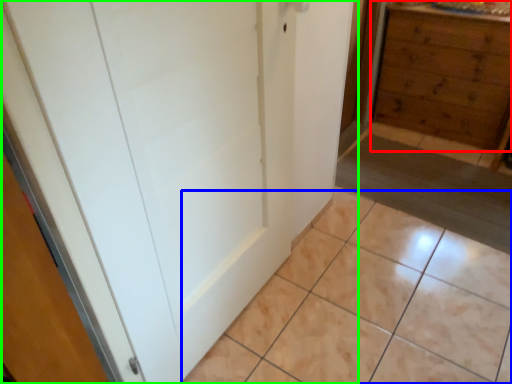
Question: Based on their relative distances, which object is farther from chest of drawers (highlighted by a red box)? Choose from ceramic tile (highlighted by a blue box) and door (highlighted by a green box).

Choices:
 (A) ceramic tile
 (B) door

Answer: (B)